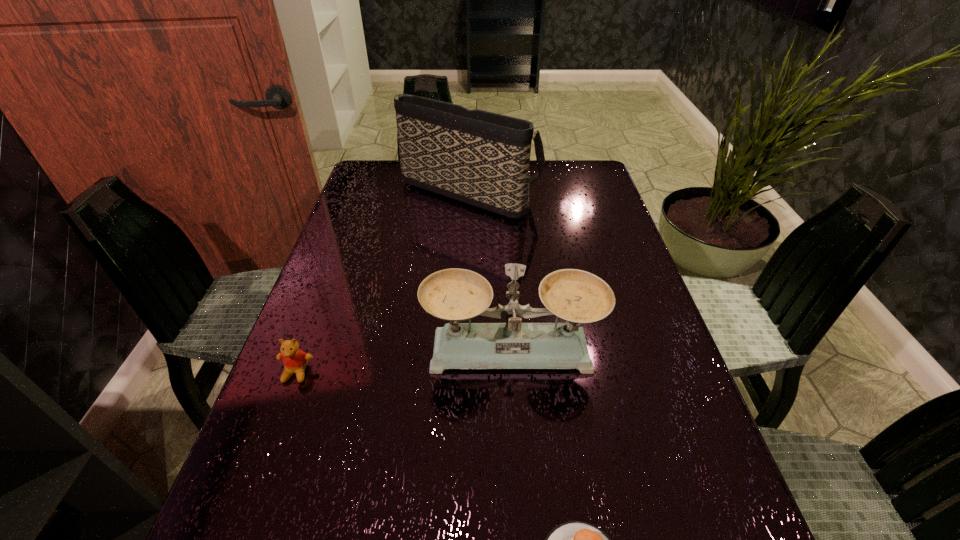
Where is `the second closest object relative to the teddy bear`? The image size is (960, 540). the second closest object relative to the teddy bear is located at coordinates (574, 539).